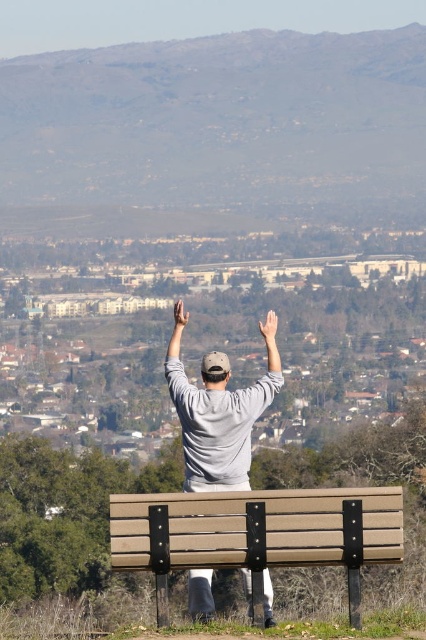
Which is more to the left, beige wood bench at center or gray matte arm at upper center?

From the viewer's perspective, beige wood bench at center appears more on the left side.

Based on the photo, is beige wood bench at center wider than gray matte arm at upper center?

Correct, the width of beige wood bench at center exceeds that of gray matte arm at upper center.

The width and height of the screenshot is (426, 640). Identify the location of beige wood bench at center. (256, 532).

Locate an element on the screen. Image resolution: width=426 pixels, height=640 pixels. beige wood bench at center is located at coordinates (256, 532).

The height and width of the screenshot is (640, 426). Describe the element at coordinates (268, 326) in the screenshot. I see `light skin tone hand at upper center` at that location.

Does point (270, 332) lie behind point (175, 324)?

No.

Find the location of a particular element. The width and height of the screenshot is (426, 640). light skin tone hand at upper center is located at coordinates (268, 326).

Which is behind, point (178, 362) or point (261, 333)?

The point (261, 333) is more distant.

The height and width of the screenshot is (640, 426). Describe the element at coordinates (176, 356) in the screenshot. I see `gray matte arm at center` at that location.

Where is `gray matte arm at center`? The width and height of the screenshot is (426, 640). gray matte arm at center is located at coordinates (176, 356).